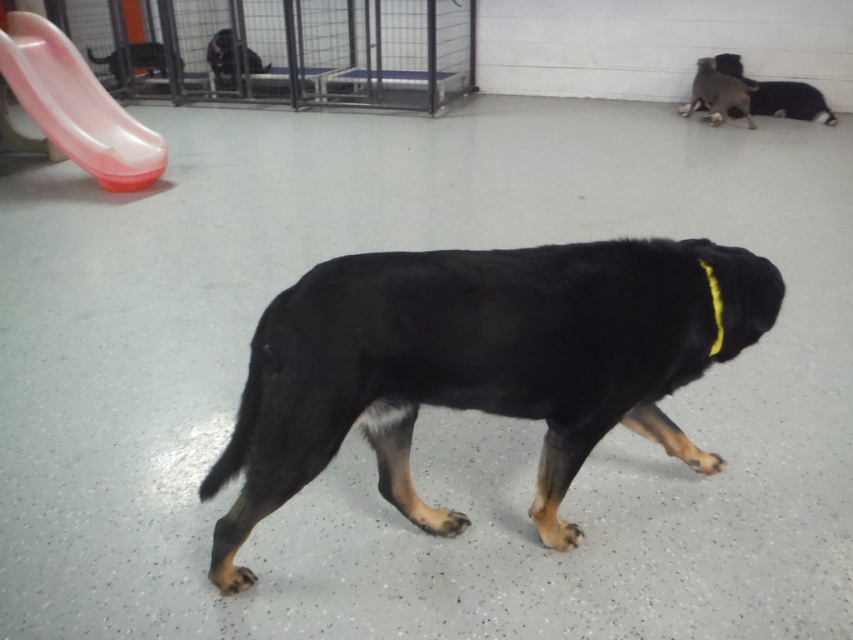
Which is in front, point (157, 35) or point (747, 120)?

Point (747, 120)

Is metal wire cage at upper left bigger than black matte dog at upper right?

Correct, metal wire cage at upper left is larger in size than black matte dog at upper right.

Where is `metal wire cage at upper left`? Image resolution: width=853 pixels, height=640 pixels. metal wire cage at upper left is located at coordinates (281, 49).

Is metal wire cage at upper left smaller than yellow fabric neckband at upper right?

Incorrect, metal wire cage at upper left is not smaller in size than yellow fabric neckband at upper right.

Does metal wire cage at upper left appear under yellow fabric neckband at upper right?

No, metal wire cage at upper left is not below yellow fabric neckband at upper right.

The width and height of the screenshot is (853, 640). In order to click on metal wire cage at upper left in this screenshot , I will do `click(281, 49)`.

Which is in front, point (326, 13) or point (260, 65)?

Point (326, 13)

Which of these two, metal wire cage at upper left or black matte dog at upper center, stands taller?

metal wire cage at upper left is taller.

Which is in front, point (228, 8) or point (252, 54)?

Point (252, 54) is more forward.

Where is `metal wire cage at upper left`? metal wire cage at upper left is located at coordinates (281, 49).